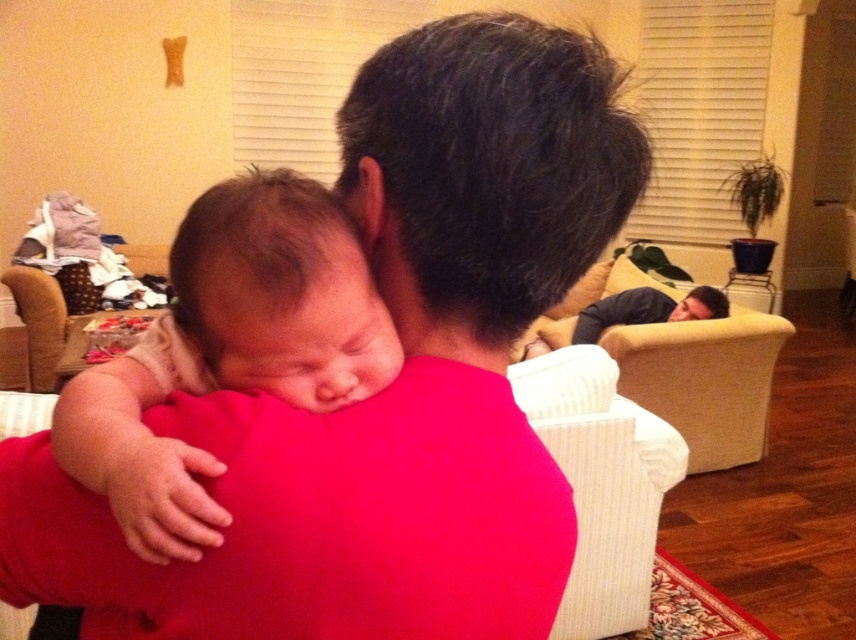
Does matte pink shirt at center appear on the left side of white textured armchair at lower center?

Indeed, matte pink shirt at center is positioned on the left side of white textured armchair at lower center.

Between point (447, 241) and point (563, 598), which one is positioned behind?

The point (563, 598) is behind.

Image resolution: width=856 pixels, height=640 pixels. Find the location of `matte pink shirt at center`. matte pink shirt at center is located at coordinates (394, 381).

How distant is matte pink shirt at center from soft beige baby at center?

matte pink shirt at center and soft beige baby at center are 2.73 inches apart from each other.

Is point (119, 628) more distant than point (311, 202)?

No, (119, 628) is closer to viewer.

I want to click on matte pink shirt at center, so click(394, 381).

Where is `matte pink shirt at center`? The height and width of the screenshot is (640, 856). matte pink shirt at center is located at coordinates (394, 381).

Is soft beige baby at center positioned before white textured armchair at lower center?

Yes, soft beige baby at center is closer to the viewer.

How much distance is there between soft beige baby at center and white textured armchair at lower center?

soft beige baby at center is 4.68 feet from white textured armchair at lower center.

The image size is (856, 640). Describe the element at coordinates (229, 352) in the screenshot. I see `soft beige baby at center` at that location.

Locate an element on the screen. The image size is (856, 640). soft beige baby at center is located at coordinates (229, 352).